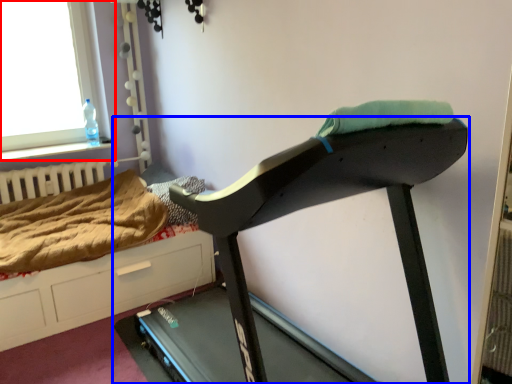
Question: Which object is further to the camera taking this photo, window (highlighted by a red box) or treadmill (highlighted by a blue box)?

Choices:
 (A) window
 (B) treadmill

Answer: (A)